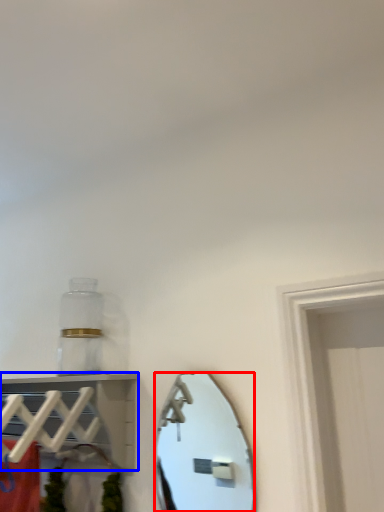
Question: Which of the following is the closest to the observer, mirror (highlighted by a red box) or shelf (highlighted by a blue box)?

Choices:
 (A) mirror
 (B) shelf

Answer: (B)